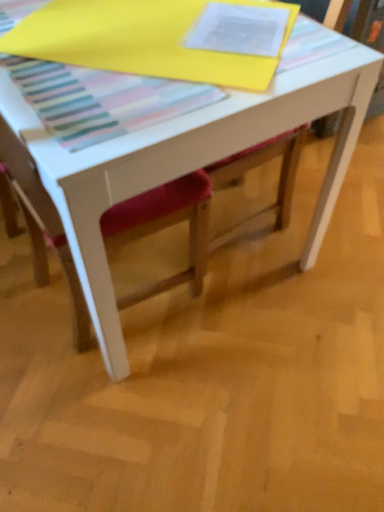
This screenshot has width=384, height=512. I want to click on unoccupied region to the right of velvet red chair at center, so pyautogui.click(x=247, y=350).